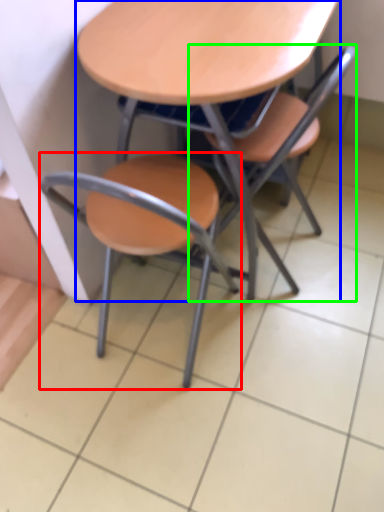
Question: Estimate the real-world distances between objects in this image. Which object is closer to chair (highlighted by a red box), table (highlighted by a blue box) or chair (highlighted by a green box)?

Choices:
 (A) table
 (B) chair

Answer: (B)